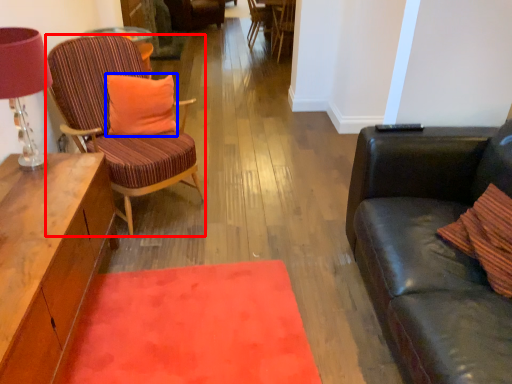
Question: Which of the following is the farthest to the observer, chair (highlighted by a red box) or pillow (highlighted by a blue box)?

Choices:
 (A) chair
 (B) pillow

Answer: (B)